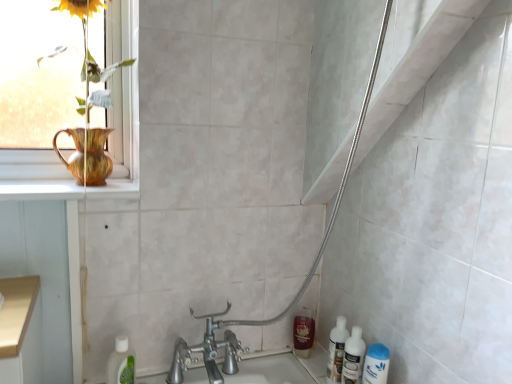
Question: From the image's perspective, is white glossy bottles at lower right, marked as the first cleaning product in a right-to-left arrangement, under white glossy mouthwash at lower right, arranged as the 2th mouthwash when viewed from the left?

Choices:
 (A) yes
 (B) no

Answer: (B)

Question: Is white glossy bottles at lower right, marked as the first cleaning product in a right-to-left arrangement, to the left of white glossy mouthwash at lower right, which is the 1th mouthwash from right to left, from the viewer's perspective?

Choices:
 (A) yes
 (B) no

Answer: (A)

Question: From the image's perspective, is white glossy bottles at lower right, marked as the first cleaning product in a right-to-left arrangement, above white glossy mouthwash at lower right, the 2th mouthwash viewed from the back?

Choices:
 (A) no
 (B) yes

Answer: (B)

Question: Is white glossy bottles at lower right, marked as the first cleaning product in a right-to-left arrangement, looking in the opposite direction of white glossy mouthwash at lower right, arranged as the 2th mouthwash when viewed from the left?

Choices:
 (A) no
 (B) yes

Answer: (A)

Question: Is white glossy bottles at lower right, marked as the first cleaning product in a right-to-left arrangement, completely or partially outside of white glossy mouthwash at lower right, arranged as the 2th mouthwash when viewed from the left?

Choices:
 (A) yes
 (B) no

Answer: (A)

Question: Considering the relative sizes of white glossy bottles at lower right, which is the second cleaning product from left to right, and white glossy mouthwash at lower right, the 2th mouthwash viewed from the back, in the image provided, is white glossy bottles at lower right, which is the second cleaning product from left to right, taller than white glossy mouthwash at lower right, the 2th mouthwash viewed from the back,?

Choices:
 (A) no
 (B) yes

Answer: (A)

Question: Is white glossy bottles at lower right, marked as the first cleaning product in a right-to-left arrangement, a part of white glossy mouthwash at lower right, arranged as the 2th mouthwash when viewed from the left?

Choices:
 (A) no
 (B) yes

Answer: (A)

Question: Is white glossy mouthwash at lower right, which is the 1th mouthwash from right to left, further to camera compared to white glossy bottles at lower right, which is the second cleaning product from left to right?

Choices:
 (A) no
 (B) yes

Answer: (A)

Question: Can you confirm if white glossy mouthwash at lower right, which is the 1th mouthwash from right to left, is shorter than white glossy bottles at lower right, which is the second cleaning product from left to right?

Choices:
 (A) no
 (B) yes

Answer: (A)

Question: Is white glossy mouthwash at lower right, arranged as the 2th mouthwash when viewed from the left, touching white glossy bottles at lower right, marked as the first cleaning product in a right-to-left arrangement?

Choices:
 (A) yes
 (B) no

Answer: (A)

Question: Is white glossy mouthwash at lower right, which is the 1th mouthwash from right to left, outside white glossy bottles at lower right, marked as the first cleaning product in a right-to-left arrangement?

Choices:
 (A) no
 (B) yes

Answer: (B)

Question: Is white glossy mouthwash at lower right, which is the 1th mouthwash from right to left, not near white glossy bottles at lower right, which is the second cleaning product from left to right?

Choices:
 (A) yes
 (B) no

Answer: (B)

Question: Considering the relative sizes of matte gold vase at upper left and white glossy mouthwash at lower right, arranged as the 2th mouthwash when viewed from the left, in the image provided, is matte gold vase at upper left shorter than white glossy mouthwash at lower right, arranged as the 2th mouthwash when viewed from the left,?

Choices:
 (A) no
 (B) yes

Answer: (A)